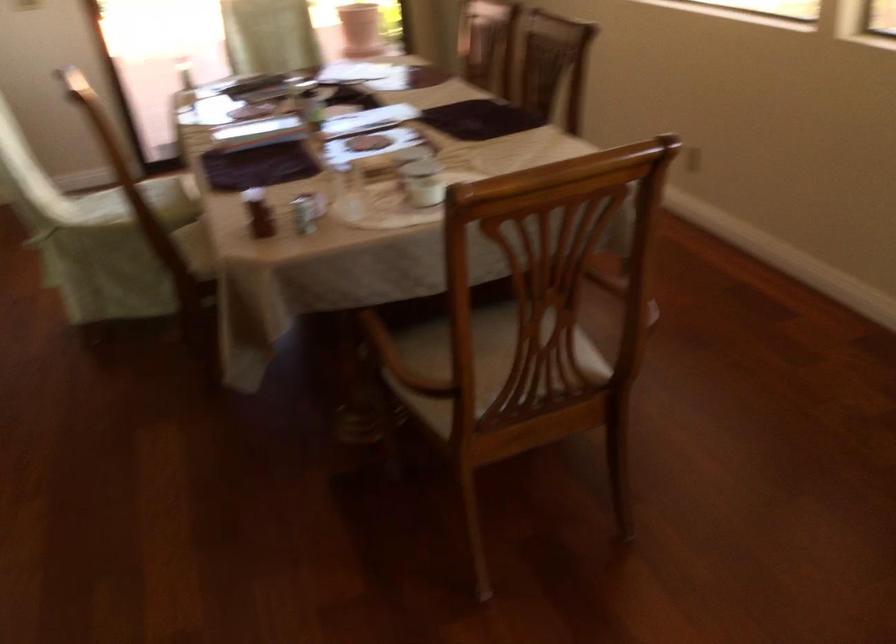
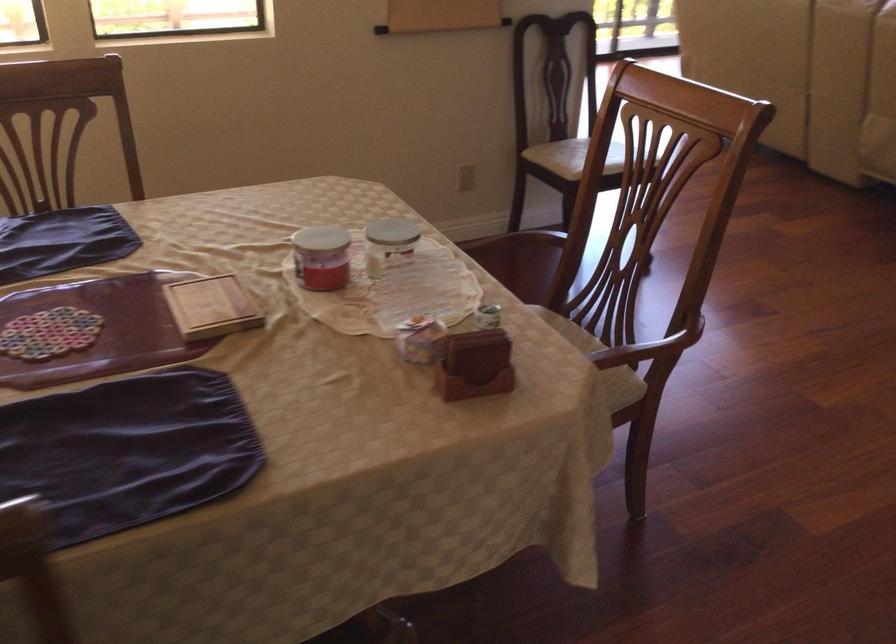
In the second image, find the point that corresponds to pixel 247 211 in the first image.

(475, 365)